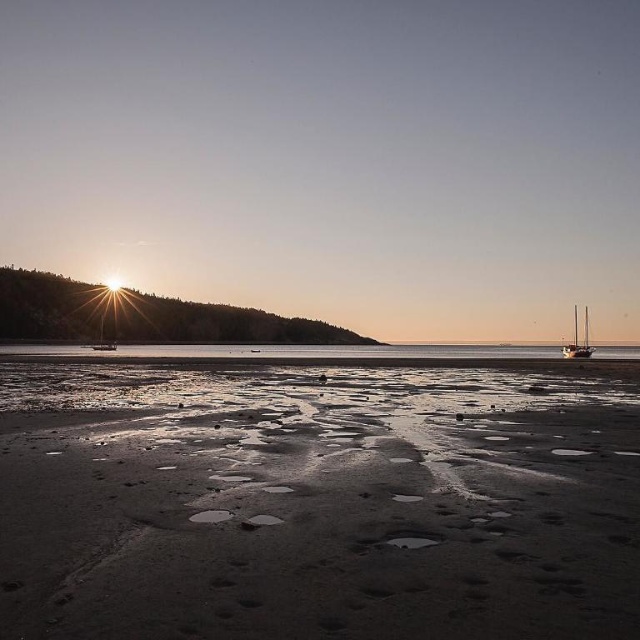
Question: Can you confirm if damp sand at center is thinner than wooden sailboat at right?

Choices:
 (A) yes
 (B) no

Answer: (A)

Question: Does damp sand at center lie behind wooden sailboat at right?

Choices:
 (A) yes
 (B) no

Answer: (B)

Question: Among these points, which one is nearest to the camera?

Choices:
 (A) (404, 403)
 (B) (586, 333)

Answer: (A)

Question: Which point is farther to the camera?

Choices:
 (A) damp sand at center
 (B) wooden sailboat at right

Answer: (B)

Question: Can you confirm if damp sand at center is smaller than wooden sailboat at right?

Choices:
 (A) no
 (B) yes

Answer: (B)